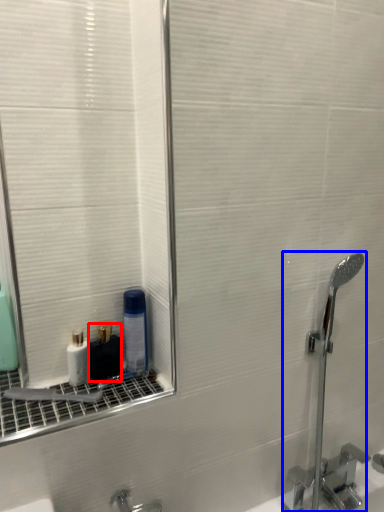
Question: Which object appears closest to the camera in this image, mouthwash (highlighted by a red box) or faucet (highlighted by a blue box)?

Choices:
 (A) mouthwash
 (B) faucet

Answer: (B)